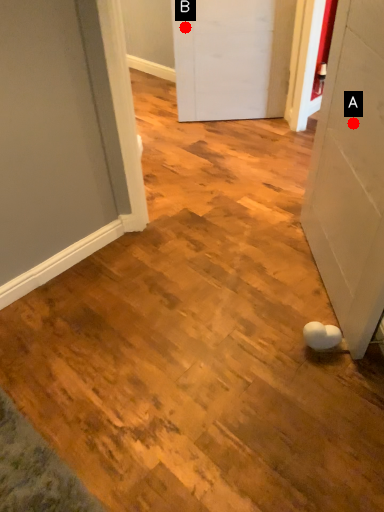
Question: Two points are circled on the image, labeled by A and B beside each circle. Which of the following is the closest to the observer?

Choices:
 (A) A is closer
 (B) B is closer

Answer: (A)